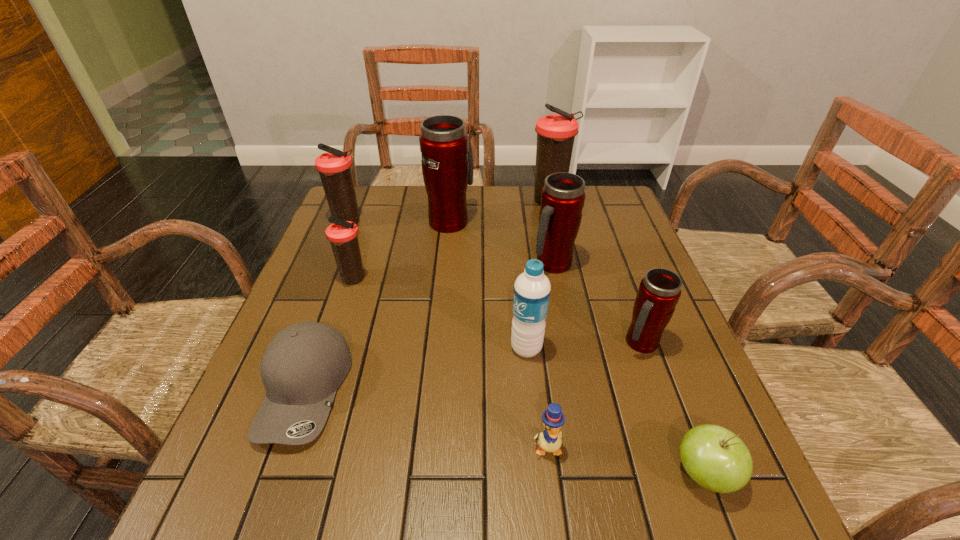
Select which brown thermos bottle appears as the closest to the smallest red thermos bottle. Please provide its 2D coordinates. Your answer should be formatted as a tuple, i.e. [(x, y)], where the tuple contains the x and y coordinates of a point satisfying the conditions above.

[(556, 133)]

Select which red thermos bottle is the closest to the nearest thermos bottle. Please provide its 2D coordinates. Your answer should be formatted as a tuple, i.e. [(x, y)], where the tuple contains the x and y coordinates of a point satisfying the conditions above.

[(562, 199)]

Locate which red thermos bottle is the closest to the farthest red thermos bottle. Please provide its 2D coordinates. Your answer should be formatted as a tuple, i.e. [(x, y)], where the tuple contains the x and y coordinates of a point satisfying the conditions above.

[(562, 199)]

Where is `free spot that satisfies the following two spatial constraints: 1. on the face of the yellow duckling, where the monocle is placed; 2. on the left side of the apple`? free spot that satisfies the following two spatial constraints: 1. on the face of the yellow duckling, where the monocle is placed; 2. on the left side of the apple is located at coordinates (550, 474).

Image resolution: width=960 pixels, height=540 pixels. Identify the location of vacant point that satisfies the following two spatial constraints: 1. on the back side of the smallest brown thermos bottle; 2. on the left side of the rightmost brown thermos bottle. (379, 201).